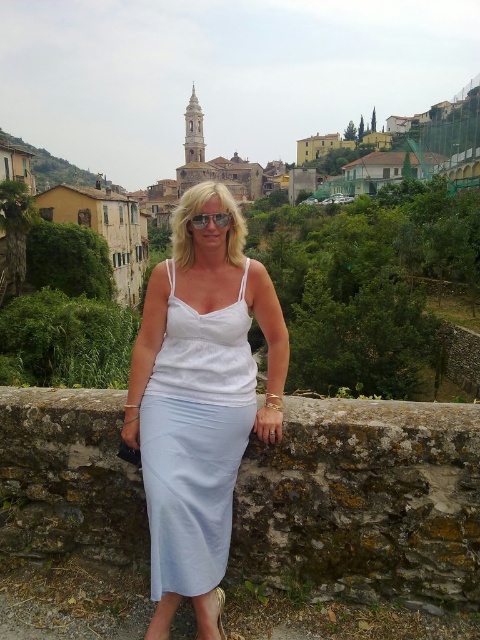
Question: Which is farther from the transparent plastic goggles at center?

Choices:
 (A) light blue fabric skirt at center
 (B) white cotton dress at center
 (C) green grassy hillside at upper left

Answer: (C)

Question: Which object appears farthest from the camera in this image?

Choices:
 (A) light blue fabric skirt at center
 (B) white cotton dress at center

Answer: (A)

Question: Is white cotton dress at center below green grassy hillside at upper left?

Choices:
 (A) yes
 (B) no

Answer: (A)

Question: Which point appears farthest from the camera in this image?

Choices:
 (A) (271, 333)
 (B) (52, 182)

Answer: (B)

Question: Can you confirm if white cotton dress at center is thinner than green grassy hillside at upper left?

Choices:
 (A) no
 (B) yes

Answer: (B)

Question: Is white cotton dress at center bigger than green grassy hillside at upper left?

Choices:
 (A) yes
 (B) no

Answer: (B)